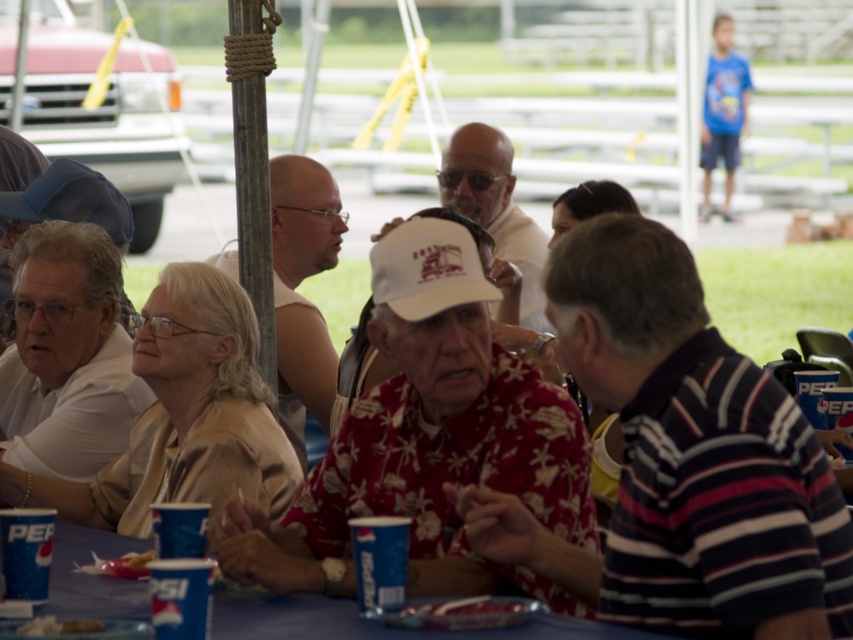
Question: Which point is farther from the camera taking this photo?

Choices:
 (A) (36, 632)
 (B) (80, 589)

Answer: (B)

Question: Is blue paper cups at lower center thinner than white paper plate at lower center?

Choices:
 (A) yes
 (B) no

Answer: (B)

Question: Among these objects, which one is farthest from the camera?

Choices:
 (A) white paper plate at lower center
 (B) blue paper cups at lower center

Answer: (B)

Question: Which point appears farthest from the camera in this image?

Choices:
 (A) (235, 618)
 (B) (91, 620)

Answer: (A)

Question: Can you confirm if blue paper cups at lower center is thinner than white paper plate at lower center?

Choices:
 (A) yes
 (B) no

Answer: (B)

Question: Is blue paper cups at lower center closer to camera compared to white paper plate at lower center?

Choices:
 (A) yes
 (B) no

Answer: (B)